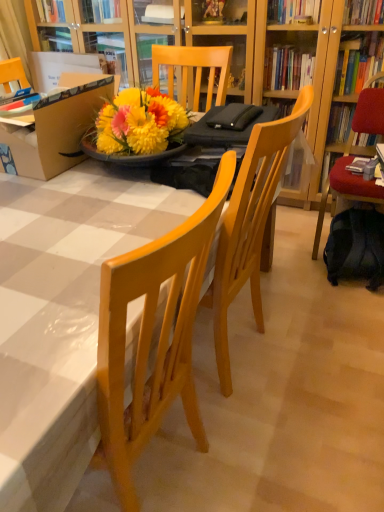
Question: Does wooden table at center have a lesser height compared to velvet red chair at right?

Choices:
 (A) yes
 (B) no

Answer: (A)

Question: Can you confirm if wooden table at center is wider than velvet red chair at right?

Choices:
 (A) no
 (B) yes

Answer: (B)

Question: Is wooden table at center to the right of velvet red chair at right from the viewer's perspective?

Choices:
 (A) no
 (B) yes

Answer: (A)

Question: Is wooden table at center not close to velvet red chair at right?

Choices:
 (A) yes
 (B) no

Answer: (A)

Question: Considering the relative sizes of wooden table at center and velvet red chair at right in the image provided, is wooden table at center smaller than velvet red chair at right?

Choices:
 (A) no
 (B) yes

Answer: (A)

Question: Is wooden table at center thinner than velvet red chair at right?

Choices:
 (A) no
 (B) yes

Answer: (A)

Question: Is dark blue fabric backpack at lower right next to hardcover book at right and touching it?

Choices:
 (A) yes
 (B) no

Answer: (B)

Question: From the image's perspective, is dark blue fabric backpack at lower right beneath hardcover book at right?

Choices:
 (A) no
 (B) yes

Answer: (B)

Question: Does dark blue fabric backpack at lower right have a larger size compared to hardcover book at right?

Choices:
 (A) yes
 (B) no

Answer: (A)

Question: Considering the relative sizes of dark blue fabric backpack at lower right and hardcover book at right in the image provided, is dark blue fabric backpack at lower right smaller than hardcover book at right?

Choices:
 (A) no
 (B) yes

Answer: (A)

Question: Is the depth of dark blue fabric backpack at lower right less than that of hardcover book at right?

Choices:
 (A) no
 (B) yes

Answer: (B)

Question: From a real-world perspective, is dark blue fabric backpack at lower right positioned over hardcover book at right based on gravity?

Choices:
 (A) yes
 (B) no

Answer: (B)

Question: Is velvet red chair at right facing towards dark blue fabric backpack at lower right?

Choices:
 (A) no
 (B) yes

Answer: (B)